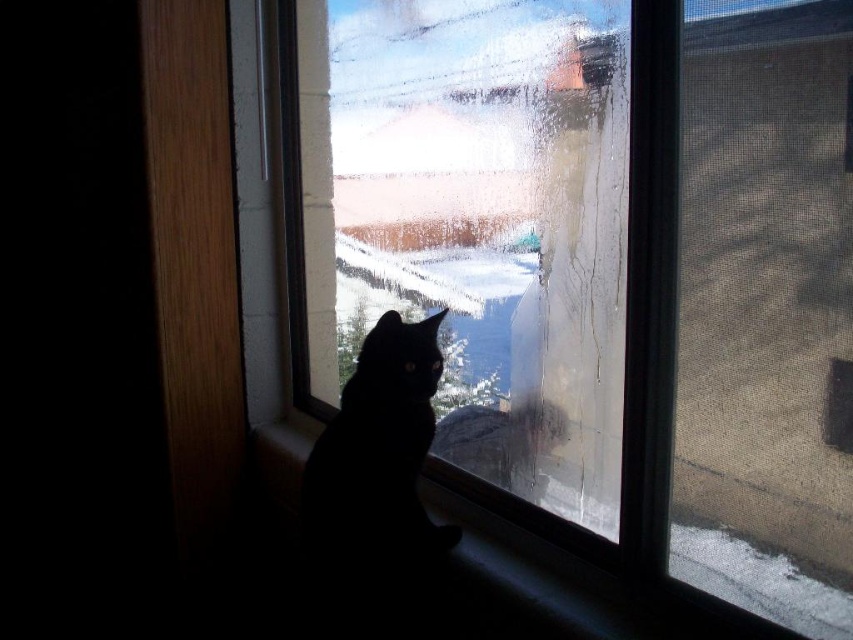
You are trying to determine if the black matte cat at center can fit entirely within the transparent glass window at center. Based on their widths, can the cat fit horizontally within the window?

The transparent glass window at center is wider than the black matte cat at center, so the cat can fit horizontally within the window.

You are trying to clean the transparent glass window at center and the smooth wood window sill at lower center. Which surface will require more cleaning effort because it is larger?

The transparent glass window at center requires more cleaning effort because it has a larger size compared to the smooth wood window sill at lower center.